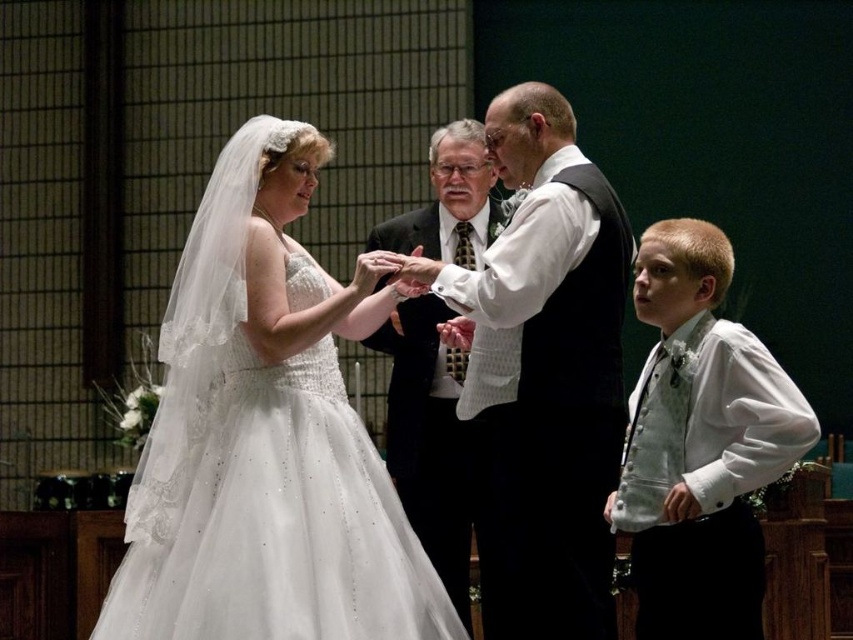
Question: Does white satin vest at right lie in front of matte black suit at center?

Choices:
 (A) no
 (B) yes

Answer: (B)

Question: Which point is farther to the camera?

Choices:
 (A) (405, 436)
 (B) (387, 266)

Answer: (A)

Question: Based on their relative distances, which object is farther from the white satin vest at right?

Choices:
 (A) matte black suit at center
 (B) white satin dress at center

Answer: (B)

Question: Is white satin dress at center below white satin vest at right?

Choices:
 (A) yes
 (B) no

Answer: (B)

Question: Does white satin vest at right have a greater width compared to matte black suit at center?

Choices:
 (A) yes
 (B) no

Answer: (A)

Question: Which of the following is the closest to the observer?

Choices:
 (A) (639, 435)
 (B) (463, 371)
 (C) (381, 307)

Answer: (A)